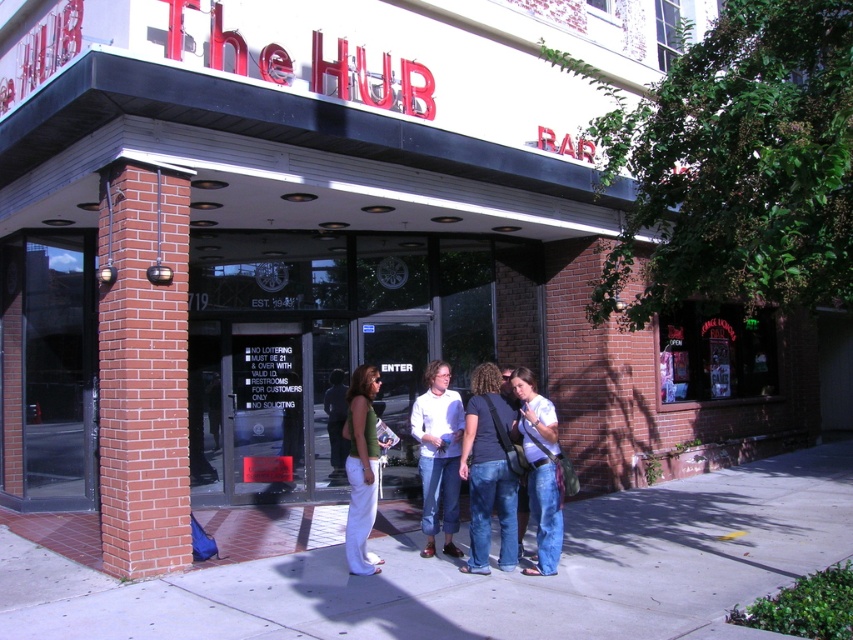
Between point (474, 422) and point (532, 424), which one is positioned behind?

The point (474, 422) is more distant.

Between point (492, 456) and point (527, 404), which one is positioned in front?

Point (492, 456) is more forward.

Is point (486, 461) less distant than point (547, 438)?

No, (486, 461) is further to viewer.

Where is `denim jeans at center`? denim jeans at center is located at coordinates (488, 472).

Is point (448, 438) positioned in front of point (334, 468)?

Yes, point (448, 438) is closer to viewer.

At what (x,y) coordinates should I click in order to perform the action: click on white cotton shirt at center. Please return your answer as a coordinate pair (x, y). Image resolution: width=853 pixels, height=640 pixels. Looking at the image, I should click on click(438, 454).

Who is more distant from viewer, (503,529) or (370,378)?

The point (370,378) is more distant.

Can you confirm if denim jeans at center is shorter than green jersey at center?

Incorrect, denim jeans at center's height does not fall short of green jersey at center's.

Is point (482, 568) less distant than point (357, 380)?

Yes, point (482, 568) is in front of point (357, 380).

This screenshot has width=853, height=640. Find the location of `denim jeans at center`. denim jeans at center is located at coordinates (488, 472).